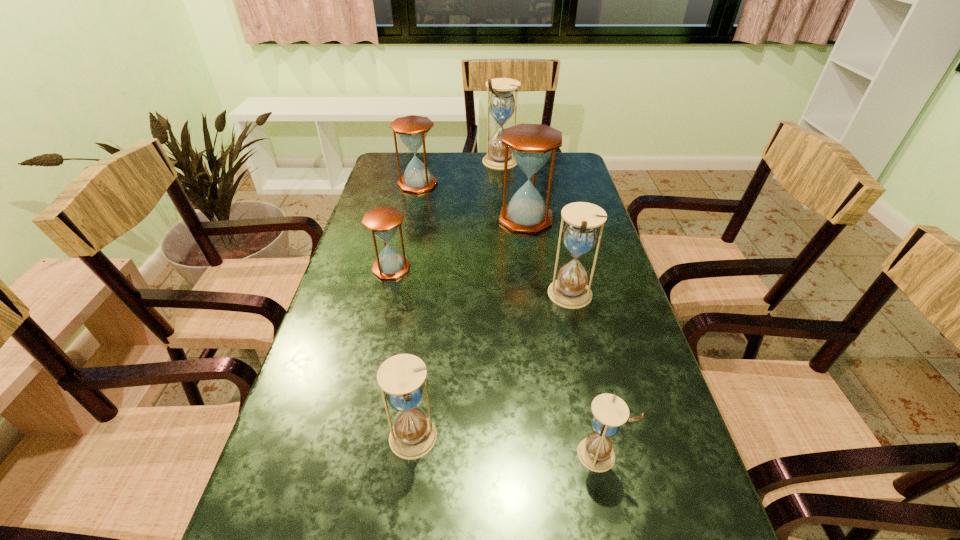
Find the location of a particular element. The width and height of the screenshot is (960, 540). the third white hourglass from right to left is located at coordinates (502, 104).

Image resolution: width=960 pixels, height=540 pixels. I want to click on the farthest white hourglass, so click(x=502, y=104).

At what (x,y) coordinates should I click in order to perform the action: click on the second farthest brown hourglass. Please return your answer as a coordinate pair (x, y). Looking at the image, I should click on click(x=531, y=145).

The width and height of the screenshot is (960, 540). I want to click on the rightmost brown hourglass, so click(x=531, y=145).

Locate an element on the screen. This screenshot has width=960, height=540. the second farthest white hourglass is located at coordinates (569, 290).

Image resolution: width=960 pixels, height=540 pixels. I want to click on the second smallest brown hourglass, so click(412, 130).

Image resolution: width=960 pixels, height=540 pixels. In order to click on the farthest brown hourglass in this screenshot , I will do `click(412, 130)`.

This screenshot has height=540, width=960. What are the coordinates of `the leftmost white hourglass` in the screenshot? It's located at (401, 377).

Identify the location of the smallest white hourglass. click(595, 452).

Locate an element on the screen. This screenshot has width=960, height=540. the smallest brown hourglass is located at coordinates (383, 221).